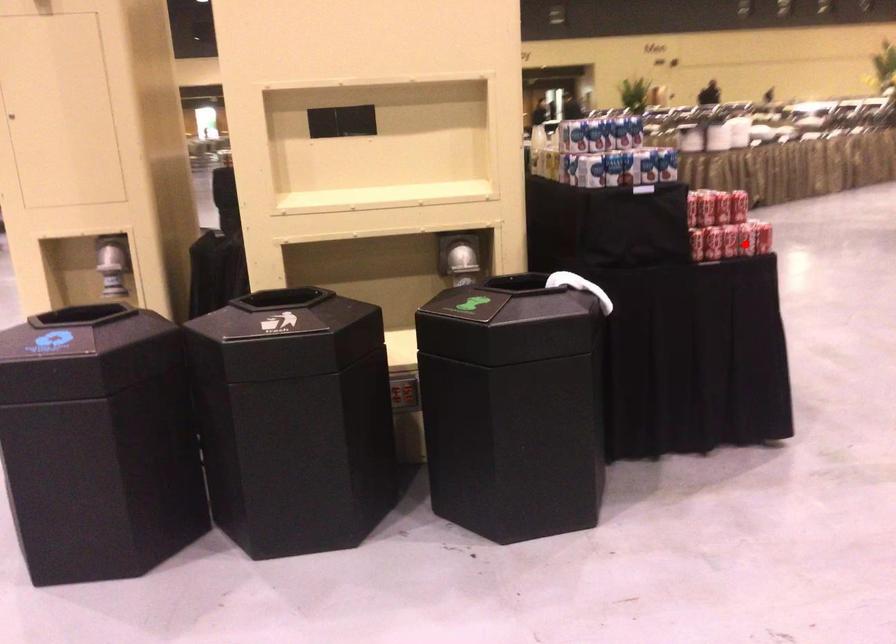
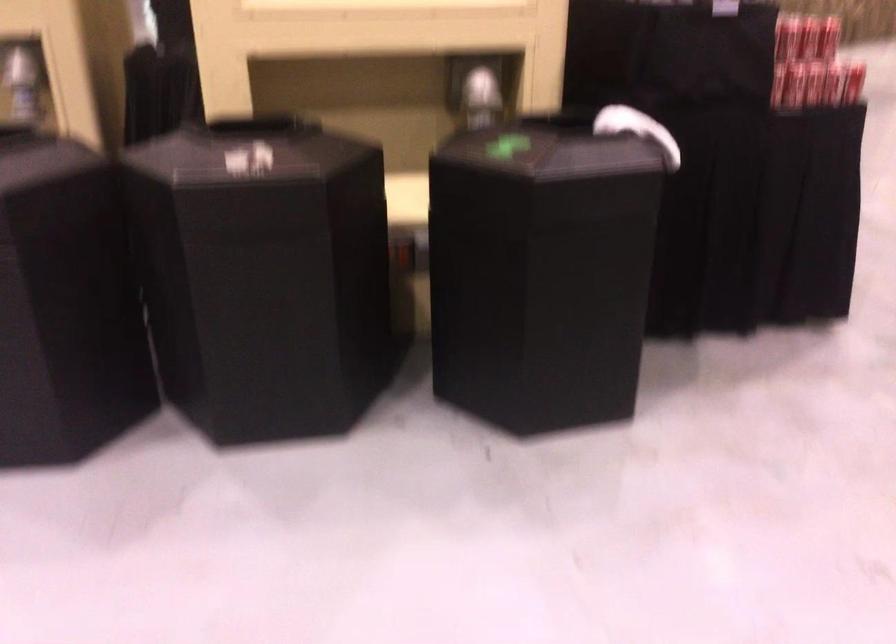
Question: A red point is marked in image1. In image2, is the corresponding 3D point closer to the camera or farther? Reply with the corresponding letter.

Choices:
 (A) The corresponding 3D point is closer.
 (B) The corresponding 3D point is farther.

Answer: (A)